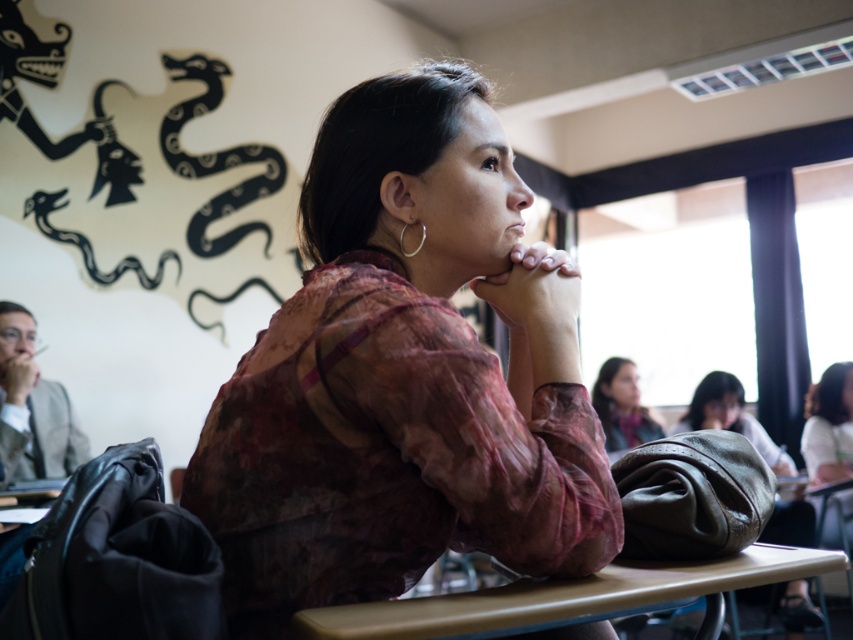
You are a photographer trying to capture the woman in the classroom. You need to ensure the matte pink blouse at center and the smooth skin hands at center are visible in the frame. Which object should be placed to the left in your photo?

The matte pink blouse at center should be placed to the left in your photo since it is positioned on the left side of the smooth skin hands at center according to the description.

You are a photographer positioned in front of the classroom scene. You want to take a photo focusing on the matte pink blouse at center and the leather bag at center. Which object will appear larger in your photo?

The matte pink blouse at center will appear larger in the photo because it is closer to the viewer than the leather bag at center.